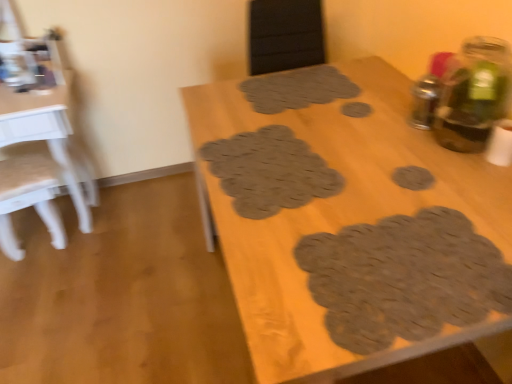
Where is `unoccupied area in front of white glossy table at left, which is the second table in right-to-left order`? The width and height of the screenshot is (512, 384). unoccupied area in front of white glossy table at left, which is the second table in right-to-left order is located at coordinates (61, 293).